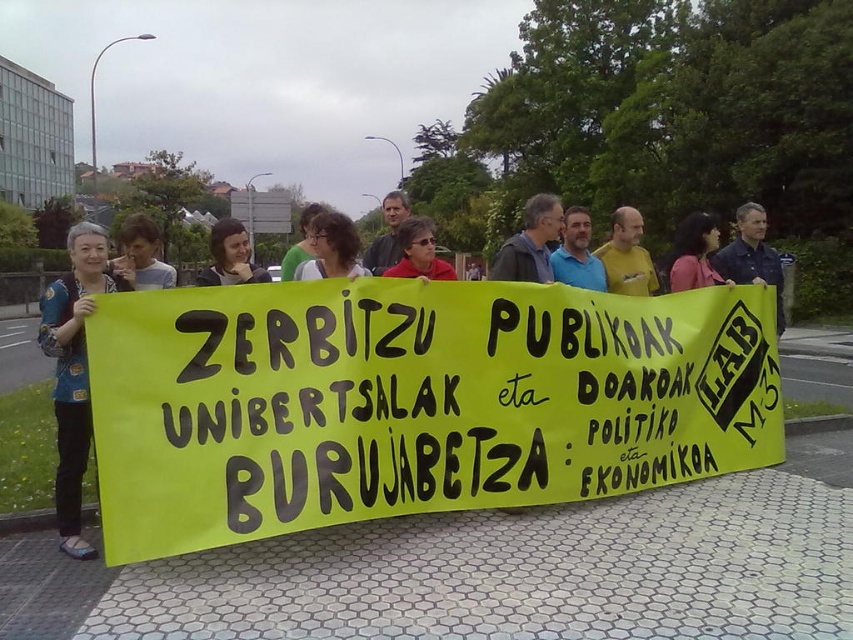
Does blue denim shirt at center appear on the right side of pink fabric shirt at center?

Correct, you'll find blue denim shirt at center to the right of pink fabric shirt at center.

Which is behind, point (776, 337) or point (711, 282)?

The point (776, 337) is more distant.

Which is behind, point (772, 257) or point (706, 244)?

The point (772, 257) is more distant.

Identify the location of blue denim shirt at center. pos(751,257).

In order to click on blue denim shirt at center in this screenshot , I will do `click(751, 257)`.

Is blue denim shirt at center to the right of matte black shirt at center from the viewer's perspective?

Yes, blue denim shirt at center is to the right of matte black shirt at center.

What do you see at coordinates (751, 257) in the screenshot? I see `blue denim shirt at center` at bounding box center [751, 257].

Locate an element on the screen. The width and height of the screenshot is (853, 640). blue denim shirt at center is located at coordinates (751, 257).

Can you confirm if matte black glasses at center is positioned to the left of blue shirt at center?

Correct, you'll find matte black glasses at center to the left of blue shirt at center.

Is matte black glasses at center to the right of blue shirt at center from the viewer's perspective?

In fact, matte black glasses at center is to the left of blue shirt at center.

Is point (296, 273) more distant than point (598, 289)?

No.

The image size is (853, 640). What are the coordinates of `matte black glasses at center` in the screenshot? It's located at (331, 248).